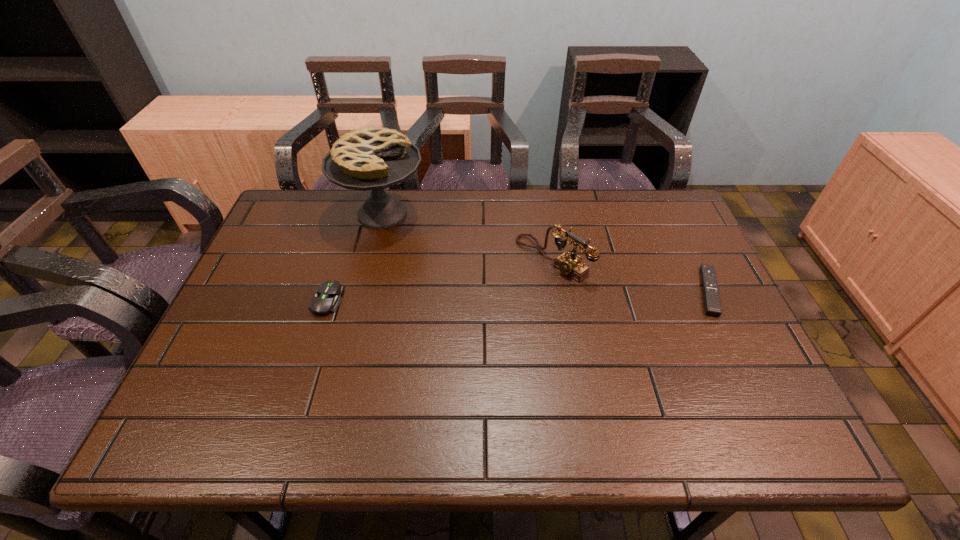
Locate an element on the screen. The height and width of the screenshot is (540, 960). vacant area that lies between the pie and the second object from right to left is located at coordinates (468, 237).

Find the location of `free spot between the computer mouse and the pie`. free spot between the computer mouse and the pie is located at coordinates (355, 257).

Identify the location of vacant area between the computer mouse and the second object from right to left. This screenshot has width=960, height=540. (440, 279).

The image size is (960, 540). Identify the location of object that is the closest to the pie. (327, 299).

Locate an element on the screen. the third closest object to the computer mouse is located at coordinates (712, 304).

Identify the location of free spot that satisfies the following two spatial constraints: 1. on the back side of the second object from right to left; 2. on the right side of the computer mouse. (340, 259).

Where is `free space that satisfies the following two spatial constraints: 1. on the back side of the second shortest object; 2. on the right side of the remote control`? free space that satisfies the following two spatial constraints: 1. on the back side of the second shortest object; 2. on the right side of the remote control is located at coordinates (330, 291).